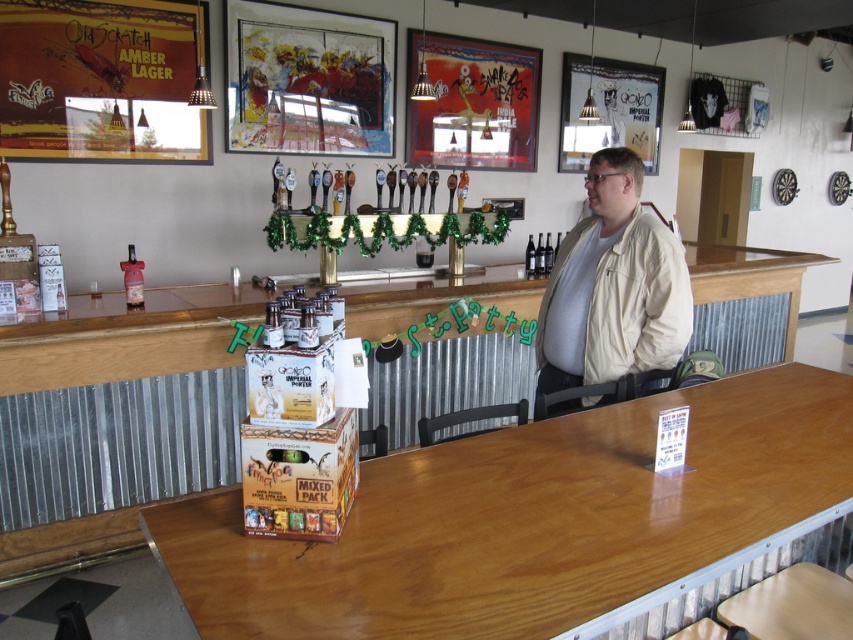
You are a customer sitting at the wooden table at center in a pub. You want to grab a beer from the counter where the banner is displayed. Can you reach it without leaving your seat?

The wooden table at center is 1.13 meters away from the viewer. Since the counter with the banner is likely further away than that distance, you would need to leave your seat to reach the beer.

You are a customer entering the bar and want to read the matte wooden signboard at upper left and also see the beige leather jacket at center. Which object is bigger in size?

The matte wooden signboard at upper left has a larger size compared to the beige leather jacket at center, so the matte wooden signboard at upper left is bigger in size.

You are a customer at the bar and want to place your phone on the wooden table at center and the matte wooden signboard at upper left. Which surface can accommodate your phone better based on their sizes?

The wooden table at center is larger in size than the matte wooden signboard at upper left, so the wooden table at center can accommodate the phone better.